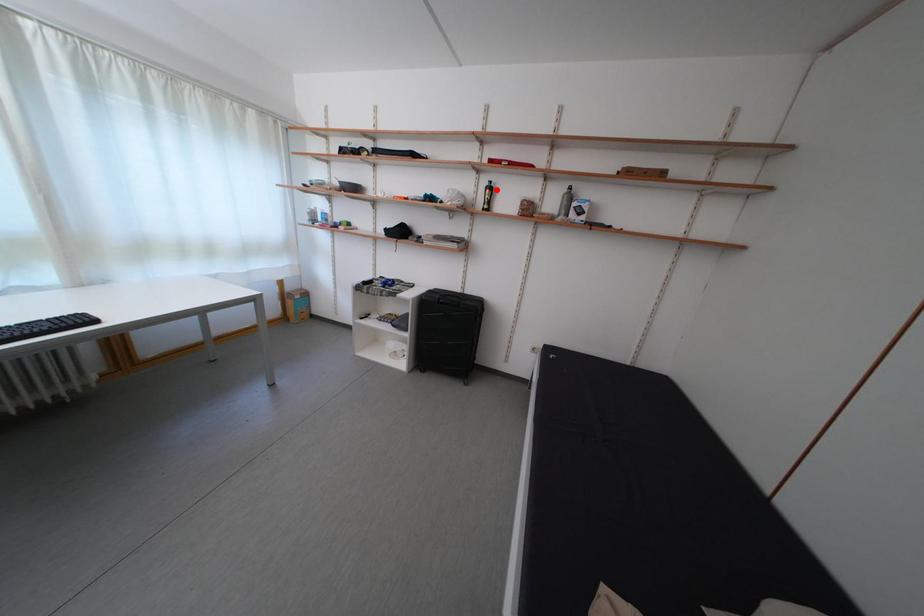
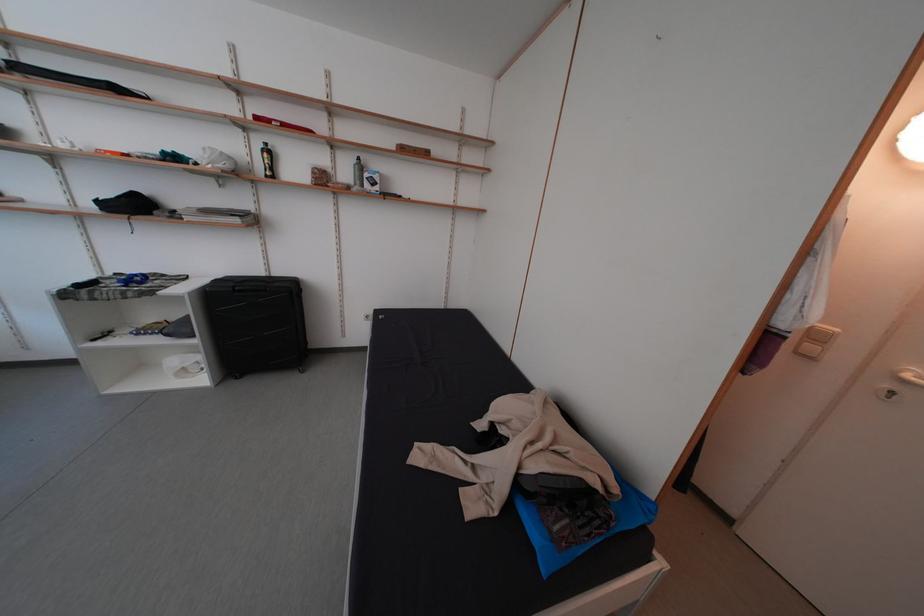
Where in the second image is the point corresponding to the highlighted location from the first image?

(272, 152)